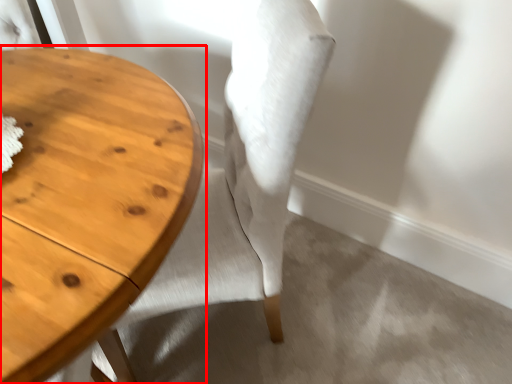
Question: From the image's perspective, where is table (annotated by the red box) located in relation to chair in the image?

Choices:
 (A) above
 (B) below

Answer: (B)